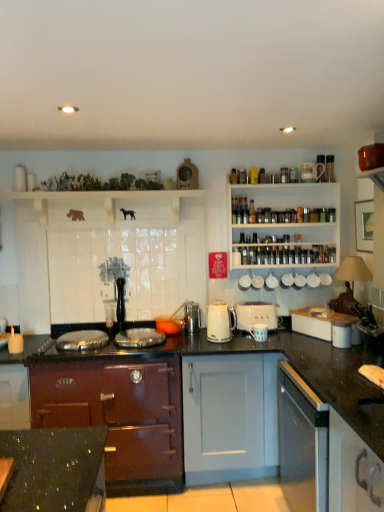
Question: Does metallic silver toaster at center, which is the fifth appliance from right to left, have a greater height compared to white plastic toaster at center-right, acting as the 4th appliance starting from the left?

Choices:
 (A) no
 (B) yes

Answer: (A)

Question: Can you confirm if metallic silver toaster at center, which is counted as the second appliance, starting from the left, is bigger than white plastic toaster at center-right, acting as the 4th appliance starting from the left?

Choices:
 (A) yes
 (B) no

Answer: (B)

Question: Is metallic silver toaster at center, which is the fifth appliance from right to left, thinner than white plastic toaster at center-right, acting as the 4th appliance starting from the left?

Choices:
 (A) yes
 (B) no

Answer: (A)

Question: Could you tell me if metallic silver toaster at center, which is counted as the second appliance, starting from the left, is facing white plastic toaster at center-right, marked as the 3th appliance in a right-to-left arrangement?

Choices:
 (A) no
 (B) yes

Answer: (A)

Question: Is metallic silver toaster at center, which is the fifth appliance from right to left, with white plastic toaster at center-right, marked as the 3th appliance in a right-to-left arrangement?

Choices:
 (A) yes
 (B) no

Answer: (B)

Question: Is white glossy cup at upper right, acting as the 6th appliance starting from the left, taller or shorter than white ceramic mugs at upper center, placed as the second appliance when sorted from right to left?

Choices:
 (A) short
 (B) tall

Answer: (B)

Question: Based on their sizes in the image, would you say white glossy cup at upper right, acting as the 6th appliance starting from the left, is bigger or smaller than white ceramic mugs at upper center, placed as the second appliance when sorted from right to left?

Choices:
 (A) small
 (B) big

Answer: (A)

Question: Would you say white glossy cup at upper right, which appears as the 1th appliance when viewed from the right, is inside or outside white ceramic mugs at upper center, placed as the second appliance when sorted from right to left?

Choices:
 (A) outside
 (B) inside

Answer: (A)

Question: Would you say white glossy cup at upper right, which appears as the 1th appliance when viewed from the right, is to the left or to the right of white ceramic mugs at upper center, the fifth appliance from the left, in the picture?

Choices:
 (A) left
 (B) right

Answer: (B)

Question: From the image's perspective, is white plastic toaster at center-right, marked as the 3th appliance in a right-to-left arrangement, positioned above or below white ceramic mug at center, positioned as the third appliance in left-to-right order?

Choices:
 (A) below
 (B) above

Answer: (B)

Question: In terms of height, does white plastic toaster at center-right, acting as the 4th appliance starting from the left, look taller or shorter compared to white ceramic mug at center, arranged as the fourth appliance when viewed from the right?

Choices:
 (A) short
 (B) tall

Answer: (B)

Question: Is white plastic toaster at center-right, marked as the 3th appliance in a right-to-left arrangement, inside or outside of white ceramic mug at center, arranged as the fourth appliance when viewed from the right?

Choices:
 (A) inside
 (B) outside

Answer: (B)

Question: Considering their positions, is white plastic toaster at center-right, marked as the 3th appliance in a right-to-left arrangement, located in front of or behind white ceramic mug at center, arranged as the fourth appliance when viewed from the right?

Choices:
 (A) behind
 (B) front

Answer: (A)

Question: Considering the positions of white matte cabinet at right, the first cabinetry when ordered from top to bottom, and orange glass bowl at center, which is the 1th appliance from left to right, in the image, is white matte cabinet at right, the first cabinetry when ordered from top to bottom, taller or shorter than orange glass bowl at center, which is the 1th appliance from left to right,?

Choices:
 (A) tall
 (B) short

Answer: (A)

Question: Visually, is white matte cabinet at right, which appears as the 2th cabinetry when viewed from the left, positioned to the left or to the right of orange glass bowl at center, placed as the 6th appliance when sorted from right to left?

Choices:
 (A) right
 (B) left

Answer: (A)